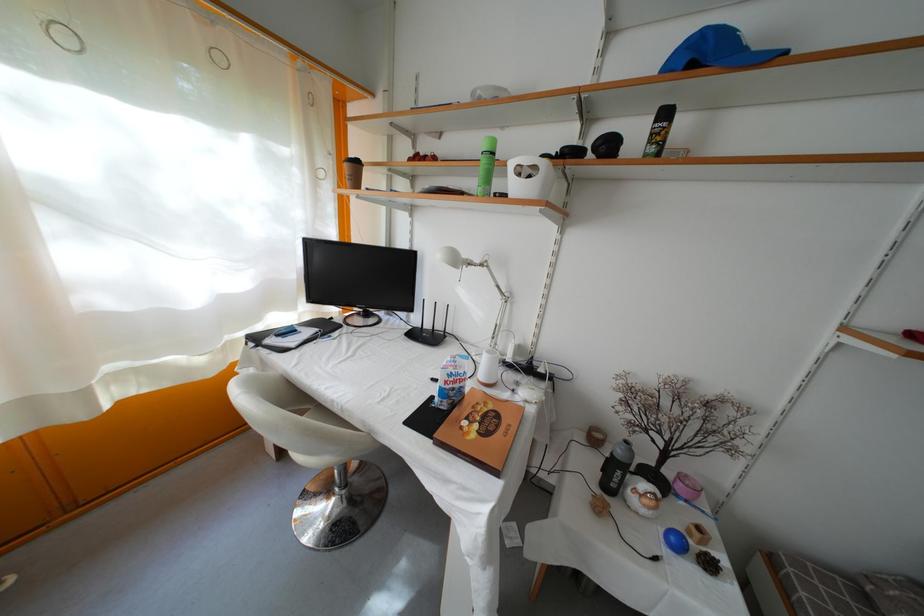
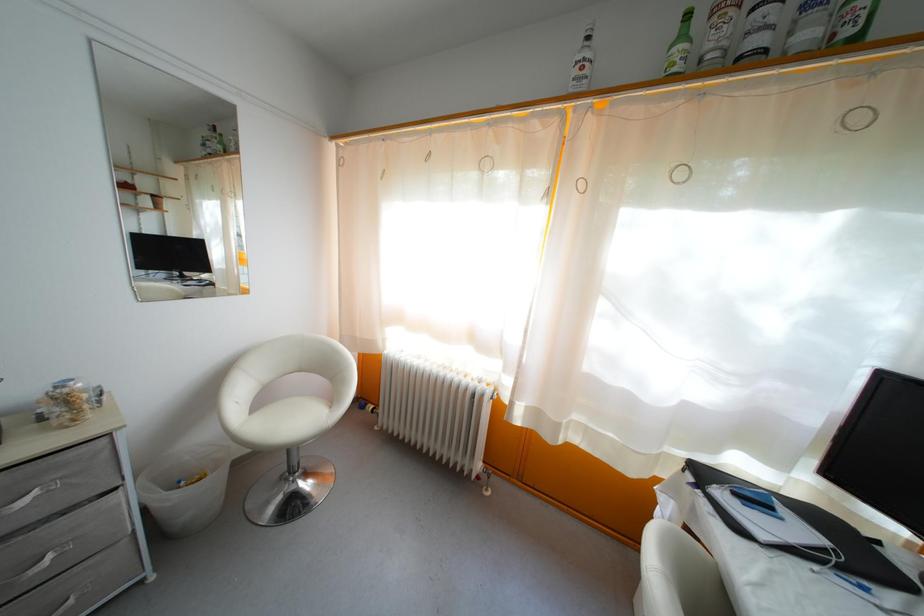
Question: The camera is either moving clockwise (left) or counter-clockwise (right) around the object. The first image is from the beginning of the video and the second image is from the end. Is the camera moving left or right when shooting the video?

Choices:
 (A) Left
 (B) Right

Answer: (B)